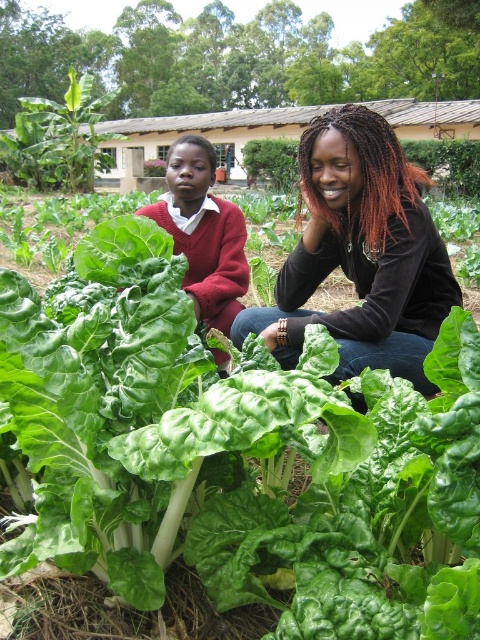
Question: Can you confirm if black matte shirt at center is positioned below matte red sweater at center?

Choices:
 (A) no
 (B) yes

Answer: (B)

Question: Is black matte shirt at center in front of matte red sweater at center?

Choices:
 (A) yes
 (B) no

Answer: (A)

Question: Among these objects, which one is farthest from the camera?

Choices:
 (A) matte red sweater at center
 (B) black matte shirt at center

Answer: (A)

Question: Is black matte shirt at center smaller than matte red sweater at center?

Choices:
 (A) yes
 (B) no

Answer: (B)